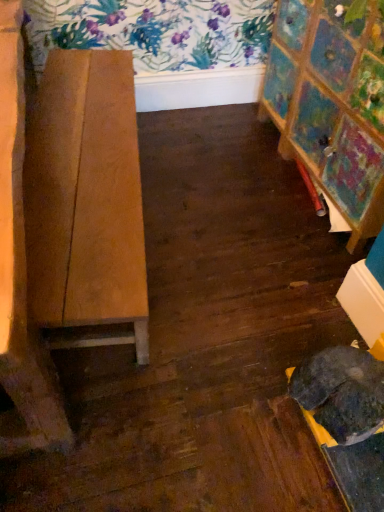
Question: Is wooden table at left in front of or behind painted wood easel at right in the image?

Choices:
 (A) behind
 (B) front

Answer: (B)

Question: From the image's perspective, is wooden table at left above or below painted wood easel at right?

Choices:
 (A) below
 (B) above

Answer: (A)

Question: Would you say wooden table at left is to the left or to the right of painted wood easel at right in the picture?

Choices:
 (A) left
 (B) right

Answer: (A)

Question: Is point (339, 79) positioned closer to the camera than point (36, 142)?

Choices:
 (A) closer
 (B) farther

Answer: (B)

Question: Based on their positions, is painted wood easel at right located to the left or right of wooden table at left?

Choices:
 (A) right
 (B) left

Answer: (A)

Question: In terms of size, does painted wood easel at right appear bigger or smaller than wooden table at left?

Choices:
 (A) small
 (B) big

Answer: (A)

Question: Is painted wood easel at right in front of or behind wooden table at left in the image?

Choices:
 (A) front
 (B) behind

Answer: (B)